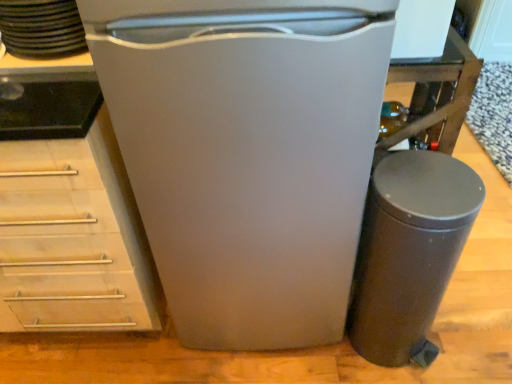
Question: From the image's perspective, relative to matte black trash can at lower right, is black matte stack of plates at upper left above or below?

Choices:
 (A) below
 (B) above

Answer: (B)

Question: From a real-world perspective, is black matte stack of plates at upper left physically located above or below matte black trash can at lower right?

Choices:
 (A) above
 (B) below

Answer: (A)

Question: Which of these objects is positioned farthest from the white matte refrigerator at center?

Choices:
 (A) black matte stack of plates at upper left
 (B) matte black trash can at lower right

Answer: (A)

Question: Estimate the real-world distances between objects in this image. Which object is farther from the white matte refrigerator at center?

Choices:
 (A) black matte stack of plates at upper left
 (B) matte black trash can at lower right

Answer: (A)